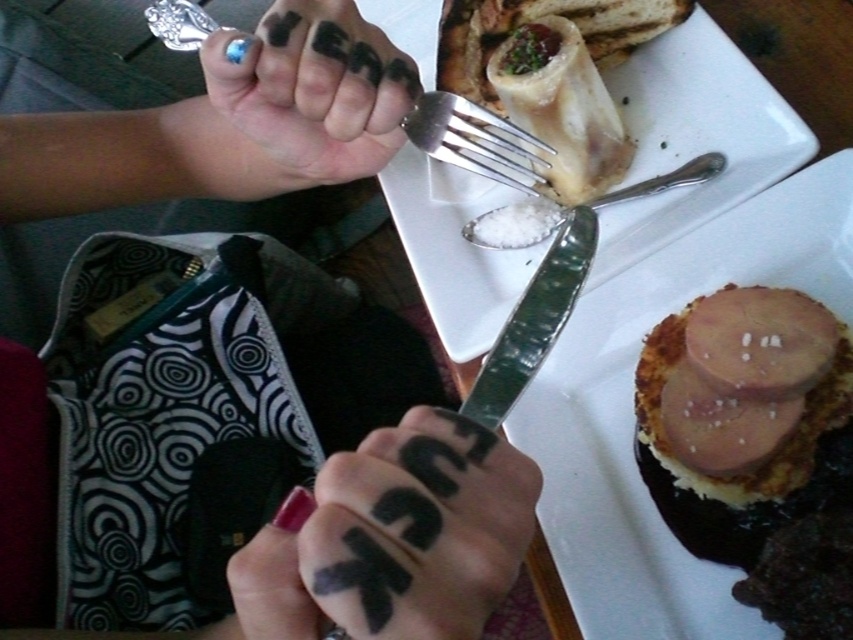
Question: Which object is positioned closest to the white creamy bone marrow at upper center?

Choices:
 (A) sleek silver knife at upper center
 (B) silver metallic fork at upper center

Answer: (B)

Question: Is black painted nails at center above sleek silver knife at upper center?

Choices:
 (A) yes
 (B) no

Answer: (A)

Question: Which of the following is the farthest from the observer?

Choices:
 (A) (526, 522)
 (B) (219, 161)

Answer: (B)

Question: Can you confirm if white ceramic plate at center is smaller than slightly pinkish matte ham at upper right?

Choices:
 (A) no
 (B) yes

Answer: (A)

Question: Can you confirm if sleek silver knife at upper center is positioned to the left of green textured knife at center?

Choices:
 (A) no
 (B) yes

Answer: (A)

Question: Which point is closer to the camera taking this photo?

Choices:
 (A) (158, 22)
 (B) (497, 26)
 (C) (517, 342)
 (D) (293, 132)

Answer: (C)